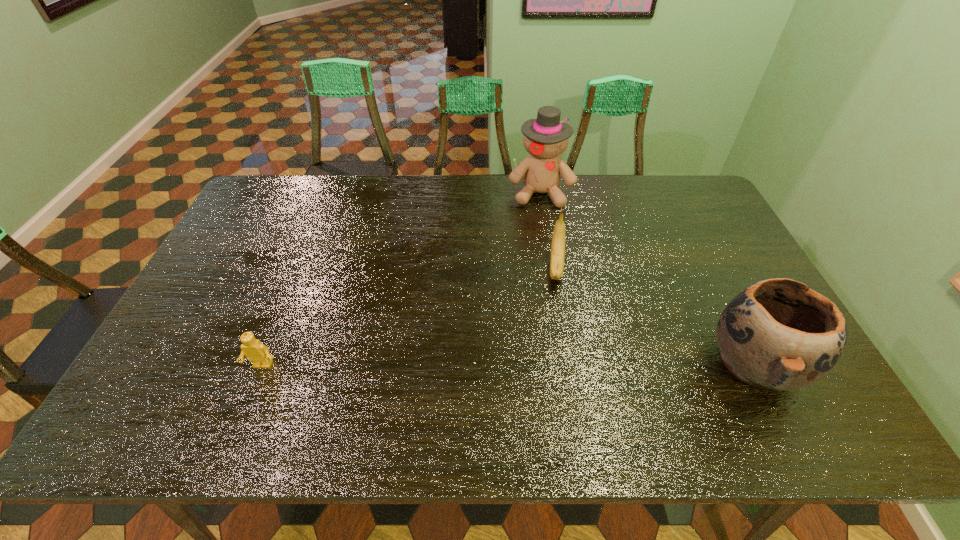
The height and width of the screenshot is (540, 960). Identify the location of vacant space on the desktop that is between the Lego and the second tallest object and is positioned at the start of the peel on the banana. (553, 365).

Image resolution: width=960 pixels, height=540 pixels. Find the location of `vacant space on the desktop that is between the Lego and the pottery and is positioned on the front-facing side of the farthest object`. vacant space on the desktop that is between the Lego and the pottery and is positioned on the front-facing side of the farthest object is located at coordinates (553, 365).